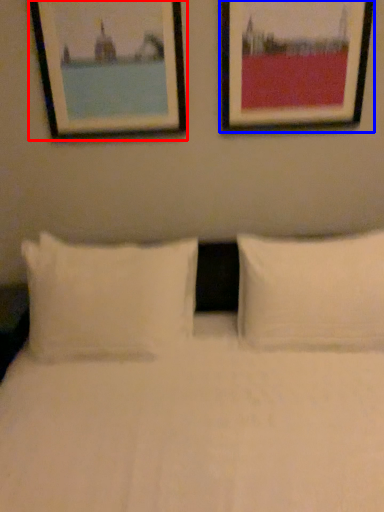
Question: Among these objects, which one is nearest to the camera, picture frame (highlighted by a red box) or picture frame (highlighted by a blue box)?

Choices:
 (A) picture frame
 (B) picture frame

Answer: (B)